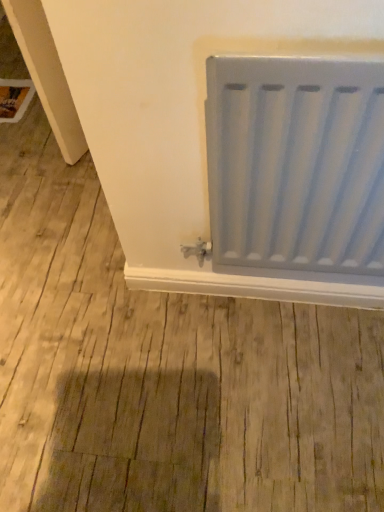
Question: Is satin white radiator at right to the right of white matte window sill at lower center from the viewer's perspective?

Choices:
 (A) no
 (B) yes

Answer: (B)

Question: Does satin white radiator at right lie behind white matte window sill at lower center?

Choices:
 (A) no
 (B) yes

Answer: (A)

Question: Is white matte window sill at lower center surrounded by satin white radiator at right?

Choices:
 (A) no
 (B) yes

Answer: (A)

Question: Is satin white radiator at right outside of white matte window sill at lower center?

Choices:
 (A) no
 (B) yes

Answer: (B)

Question: Does satin white radiator at right have a greater height compared to white matte window sill at lower center?

Choices:
 (A) no
 (B) yes

Answer: (B)

Question: Considering the relative sizes of satin white radiator at right and white matte window sill at lower center in the image provided, is satin white radiator at right smaller than white matte window sill at lower center?

Choices:
 (A) yes
 (B) no

Answer: (B)

Question: Does white matte window sill at lower center touch satin white radiator at right?

Choices:
 (A) yes
 (B) no

Answer: (B)

Question: Considering the relative sizes of white matte window sill at lower center and satin white radiator at right in the image provided, is white matte window sill at lower center wider than satin white radiator at right?

Choices:
 (A) no
 (B) yes

Answer: (A)

Question: Does white matte window sill at lower center turn towards satin white radiator at right?

Choices:
 (A) no
 (B) yes

Answer: (A)

Question: Is white matte window sill at lower center turned away from satin white radiator at right?

Choices:
 (A) yes
 (B) no

Answer: (B)

Question: Does white matte window sill at lower center have a lesser height compared to satin white radiator at right?

Choices:
 (A) yes
 (B) no

Answer: (A)

Question: Is the depth of white matte window sill at lower center greater than that of satin white radiator at right?

Choices:
 (A) no
 (B) yes

Answer: (B)

Question: Considering the positions of satin white radiator at right and white matte window sill at lower center in the image, is satin white radiator at right bigger or smaller than white matte window sill at lower center?

Choices:
 (A) small
 (B) big

Answer: (B)